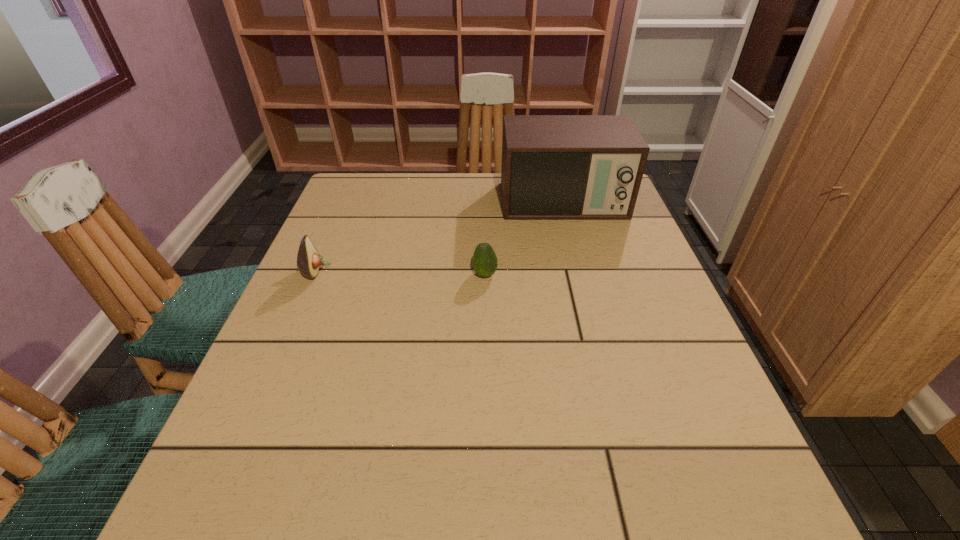
At what (x,y) coordinates should I click in order to perform the action: click on vacant region between the second tallest object and the farthest object. Please return your answer as a coordinate pair (x, y). The width and height of the screenshot is (960, 540). Looking at the image, I should click on (440, 237).

Locate an element on the screen. This screenshot has height=540, width=960. free space between the tallest object and the second shortest object is located at coordinates (440, 237).

Image resolution: width=960 pixels, height=540 pixels. I want to click on free spot between the right avocado and the radio receiver, so click(x=524, y=239).

Find the location of a particular element. The image size is (960, 540). vacant point located between the leftmost object and the second object from left to right is located at coordinates (400, 273).

At what (x,y) coordinates should I click in order to perform the action: click on vacant area that lies between the second object from left to right and the taller avocado. Please return your answer as a coordinate pair (x, y). The height and width of the screenshot is (540, 960). Looking at the image, I should click on (400, 273).

At what (x,y) coordinates should I click in order to perform the action: click on vacant space that is in between the rightmost object and the shorter avocado. Please return your answer as a coordinate pair (x, y). The image size is (960, 540). Looking at the image, I should click on (524, 239).

Find the location of a particular element. This screenshot has width=960, height=540. free space between the taller avocado and the second object from right to left is located at coordinates (400, 273).

Find the location of `free space between the tallest object and the second tallest object`. free space between the tallest object and the second tallest object is located at coordinates (440, 237).

The image size is (960, 540). Find the location of `object that ranks as the second closest to the tallest object`. object that ranks as the second closest to the tallest object is located at coordinates (308, 260).

Locate which object ranks in proximity to the shortest object. Please provide its 2D coordinates. Your answer should be formatted as a tuple, i.e. [(x, y)], where the tuple contains the x and y coordinates of a point satisfying the conditions above.

[(554, 167)]